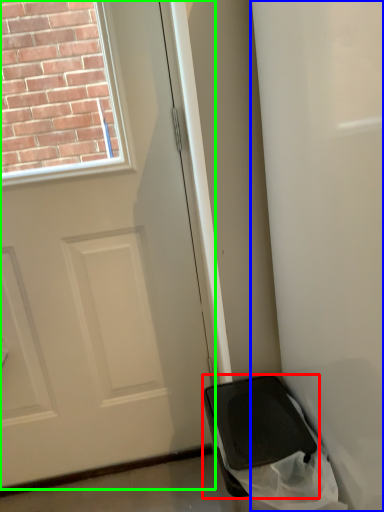
Question: Which is farther away from furniture (highlighted by a red box)? screen door (highlighted by a blue box) or door (highlighted by a green box)?

Choices:
 (A) screen door
 (B) door

Answer: (B)